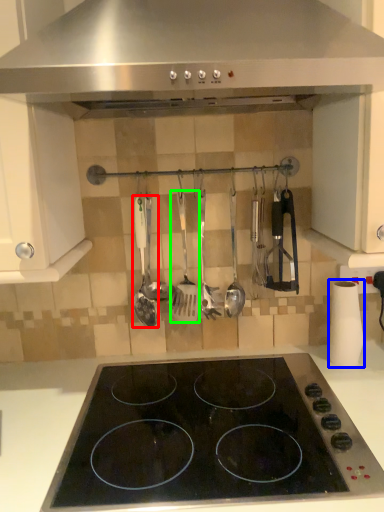
Question: Considering the real-world distances, which object is farthest from spatula (highlighted by a red box)? paper towel (highlighted by a blue box) or spatula (highlighted by a green box)?

Choices:
 (A) paper towel
 (B) spatula

Answer: (A)